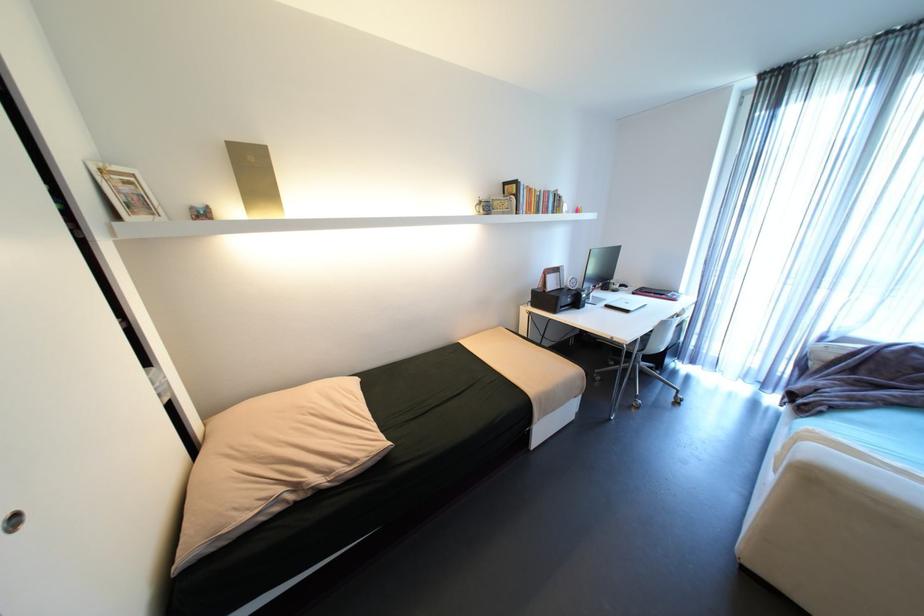
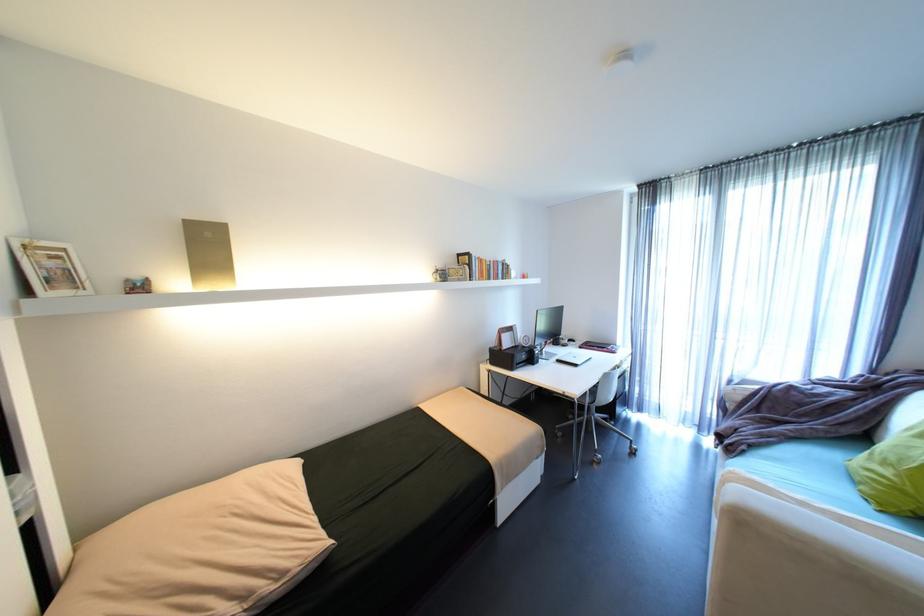
Find the pixel in the second image that matches (487,198) in the first image.

(444, 267)